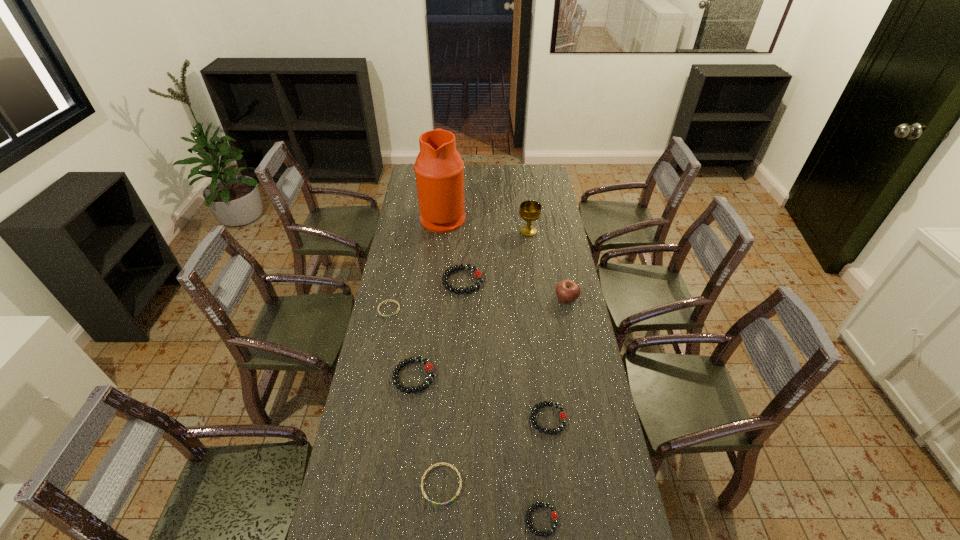
At what (x,y) coordinates should I click in order to perform the action: click on free region at the right edge. Please return your answer as a coordinate pair (x, y). Looking at the image, I should click on (549, 207).

In the image, there is a desktop. Where is `free region at the far right corner`? This screenshot has width=960, height=540. free region at the far right corner is located at coordinates click(x=536, y=170).

The image size is (960, 540). I want to click on blank region between the smallest black bracelet and the apple, so click(x=554, y=410).

The image size is (960, 540). Find the location of `free space between the fourth shortest bracelet and the smallest black bracelet`. free space between the fourth shortest bracelet and the smallest black bracelet is located at coordinates click(545, 469).

Locate an element on the screen. The height and width of the screenshot is (540, 960). vacant area that lies between the fourth nearest object and the apple is located at coordinates (491, 338).

I want to click on vacant space in between the tallest object and the smallest black bracelet, so click(492, 368).

Where is `vacant point located between the second tallest object and the tallest object`? Image resolution: width=960 pixels, height=540 pixels. vacant point located between the second tallest object and the tallest object is located at coordinates (486, 224).

Identify the location of vacant area that lies between the fourth nearest bracelet and the smallest black bracelet. (478, 448).

Where is `free space between the seventh shortest object and the seventh farthest object`? Image resolution: width=960 pixels, height=540 pixels. free space between the seventh shortest object and the seventh farthest object is located at coordinates (558, 359).

Identify the location of free space that is in between the eighth shortest object and the nearest black bracelet. (535, 376).